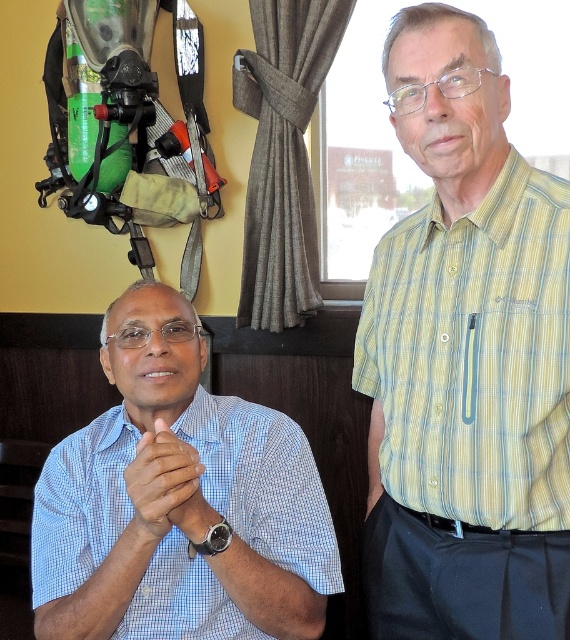
Question: Among these points, which one is nearest to the camera?

Choices:
 (A) (530, 250)
 (B) (158, 428)
 (C) (132, 84)
 (D) (278, 477)

Answer: (A)

Question: Which of these objects is positioned closest to the blue checkered shirt at center?

Choices:
 (A) brown leather watch at center
 (B) camouflage fabric backpack at upper left

Answer: (A)

Question: Is yellow striped shirt at center above blue checkered shirt at center?

Choices:
 (A) no
 (B) yes

Answer: (B)

Question: Which point appears farthest from the camera in this image?

Choices:
 (A) click(477, 266)
 (B) click(103, 88)

Answer: (B)

Question: From the image, what is the correct spatial relationship of camouflage fabric backpack at upper left in relation to brown leather watch at center?

Choices:
 (A) below
 (B) above

Answer: (B)

Question: Does yellow striped shirt at center appear under blue checkered shirt at center?

Choices:
 (A) yes
 (B) no

Answer: (B)